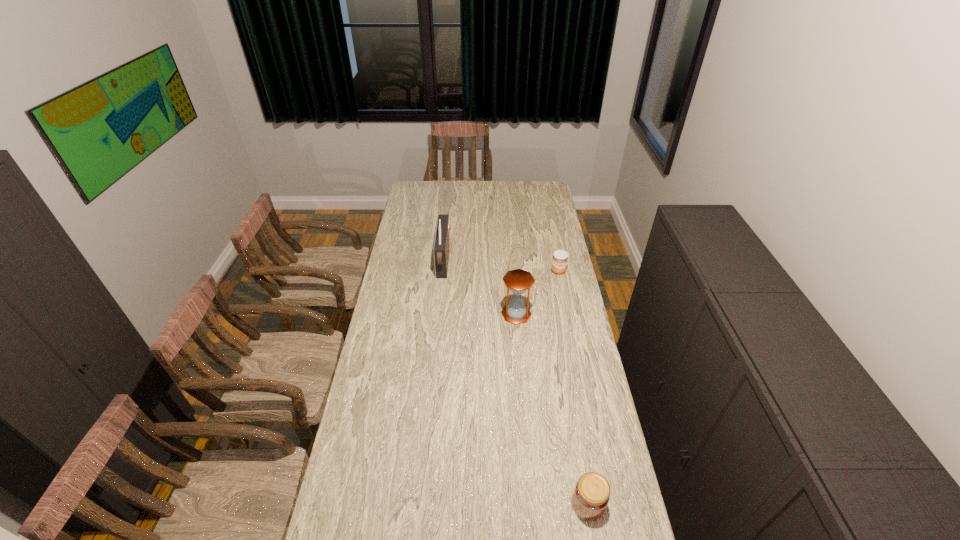
Identify the location of the leftmost object. (441, 249).

Locate an element on the screen. Image resolution: width=960 pixels, height=540 pixels. the tallest object is located at coordinates (441, 249).

At what (x,y) coordinates should I click in order to perform the action: click on the third object from right to left. Please return your answer as a coordinate pair (x, y). Looking at the image, I should click on (518, 281).

Image resolution: width=960 pixels, height=540 pixels. I want to click on the second nearest object, so click(518, 281).

Where is `the nearer jam`? The height and width of the screenshot is (540, 960). the nearer jam is located at coordinates (591, 496).

Find the location of `the farther jam`. the farther jam is located at coordinates (559, 260).

You are a GUI agent. You are given a task and a screenshot of the screen. Output one action in this format:
    pyautogui.click(x=<x>, y=<y>)
    Task: Click on the blank space located 0.200m on the front panel of the tallest object
    The width and height of the screenshot is (960, 540).
    Given the screenshot: What is the action you would take?
    pyautogui.click(x=490, y=261)

In order to click on vacant area situated on the back of the hourglass in this screenshot , I will do `click(515, 294)`.

The height and width of the screenshot is (540, 960). In order to click on free space located 0.170m on the left of the nearest object in this screenshot , I will do `click(516, 504)`.

Locate an element on the screen. vacant space situated on the front label of the farther jam is located at coordinates (570, 329).